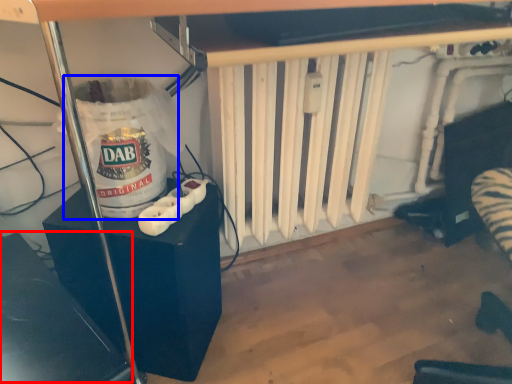
Question: Which object appears closest to the camera in this image, wide (highlighted by a red box) or water heater (highlighted by a blue box)?

Choices:
 (A) wide
 (B) water heater

Answer: (A)